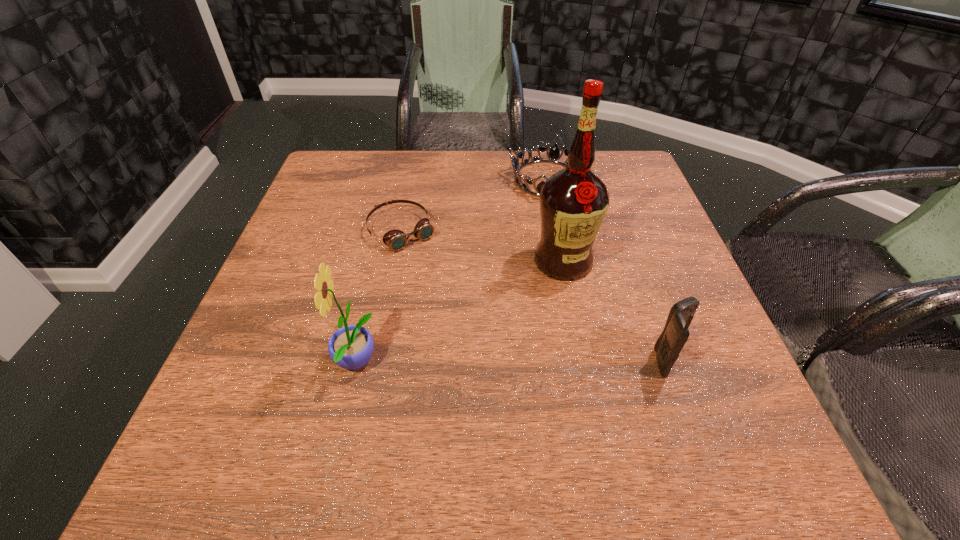
Locate an element on the screen. The width and height of the screenshot is (960, 540). sunflower is located at coordinates (350, 347).

Where is `the rightmost object`? The width and height of the screenshot is (960, 540). the rightmost object is located at coordinates (668, 346).

Where is `the third tallest object`? The height and width of the screenshot is (540, 960). the third tallest object is located at coordinates (668, 346).

Identify the location of the fourth tallest object. The width and height of the screenshot is (960, 540). (554, 155).

At what (x,y) coordinates should I click in order to perform the action: click on tiara. Please return your answer as a coordinate pair (x, y). This screenshot has width=960, height=540. Looking at the image, I should click on (554, 155).

At what (x,y) coordinates should I click in order to perform the action: click on the shortest object. Please return your answer as a coordinate pair (x, y). This screenshot has width=960, height=540. Looking at the image, I should click on (396, 240).

This screenshot has width=960, height=540. Identify the location of the tallest object. (573, 202).

The image size is (960, 540). What are the coordinates of `vacant space situated on the front-facing side of the sunflower` in the screenshot? It's located at (260, 363).

Identify the location of free spot located 0.070m on the front-facing side of the sunflower. This screenshot has height=540, width=960. (294, 363).

Identify the location of vacant space located on the front-facing side of the sunflower. The width and height of the screenshot is (960, 540). (232, 363).